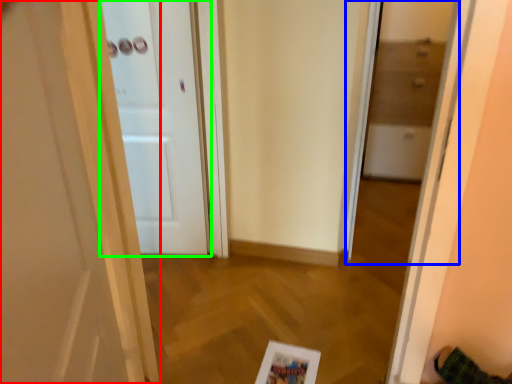
Question: Considering the real-world distances, which object is closest to door (highlighted by a red box)? glass door (highlighted by a blue box) or door (highlighted by a green box).

Choices:
 (A) glass door
 (B) door

Answer: (B)